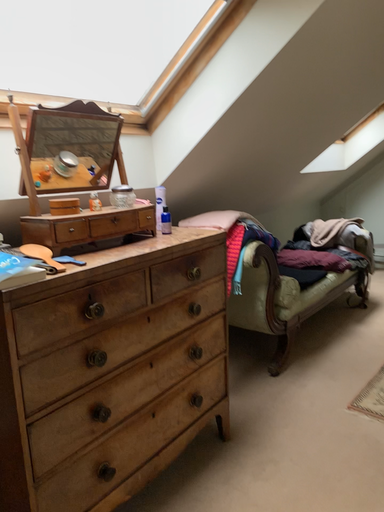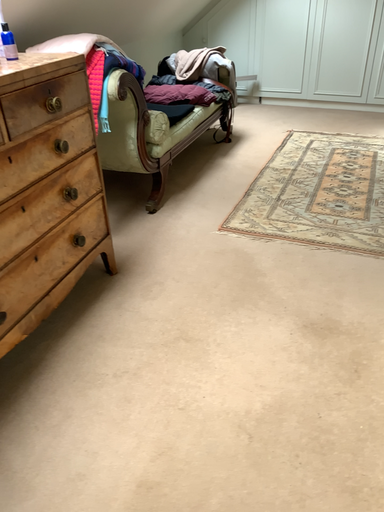
Question: Which way did the camera rotate in the video?

Choices:
 (A) rotated right
 (B) rotated left

Answer: (A)